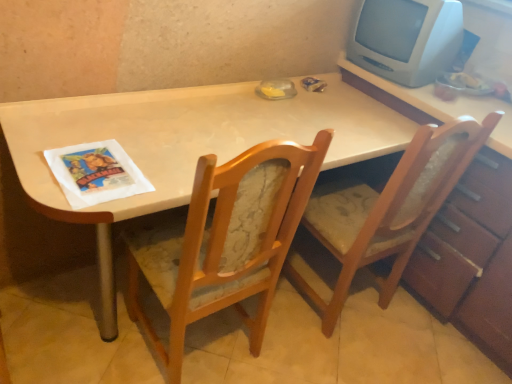
You are a GUI agent. You are given a task and a screenshot of the screen. Output one action in this format:
    pyautogui.click(x=<x>, y=<y>)
    Task: Click on the blank space to the left of white paper magazine at left
    
    Given the screenshot: What is the action you would take?
    pyautogui.click(x=36, y=144)